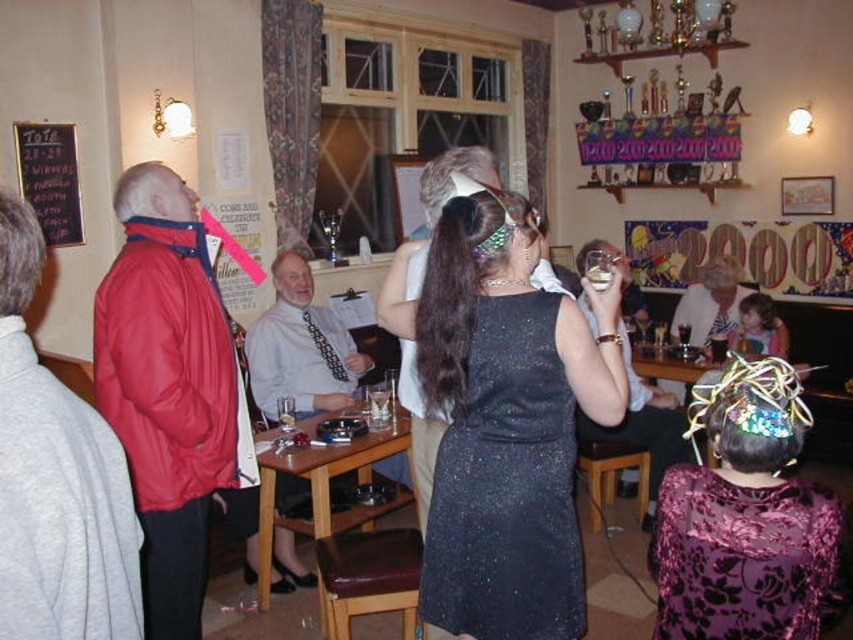
Is black chalkboard at upper left below translucent glass at upper center?

Incorrect, black chalkboard at upper left is not positioned below translucent glass at upper center.

The image size is (853, 640). What do you see at coordinates (50, 179) in the screenshot? I see `black chalkboard at upper left` at bounding box center [50, 179].

Image resolution: width=853 pixels, height=640 pixels. Describe the element at coordinates (50, 179) in the screenshot. I see `black chalkboard at upper left` at that location.

The image size is (853, 640). I want to click on black chalkboard at upper left, so click(50, 179).

In the scene shown: Does sparkly purple dress at center come behind leather cushioned stool at lower center?

No.

Looking at this image, is sparkly purple dress at center taller than leather cushioned stool at lower center?

Yes.

Is point (805, 532) positioned behind point (412, 528)?

No, (805, 532) is closer to viewer.

At what (x,y) coordinates should I click in order to perform the action: click on sparkly purple dress at center. Please return your answer as a coordinate pair (x, y). Looking at the image, I should click on (747, 518).

Between black chalkboard at upper left and brown wooden stool at lower center, which one has more height?

black chalkboard at upper left

Where is `black chalkboard at upper left`? This screenshot has width=853, height=640. black chalkboard at upper left is located at coordinates (50, 179).

Locate an element on the screen. Image resolution: width=853 pixels, height=640 pixels. black chalkboard at upper left is located at coordinates (50, 179).